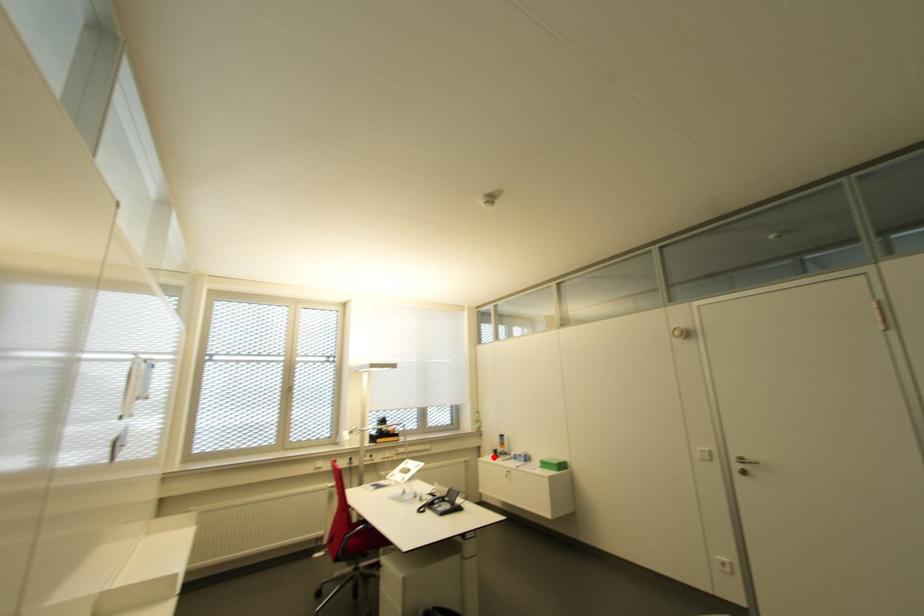
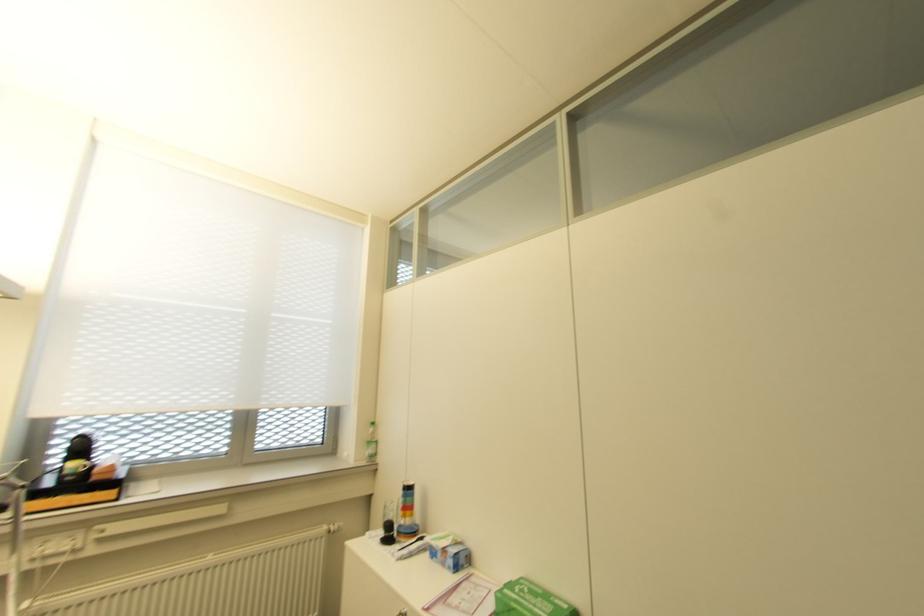
Locate, in the second image, the point that corresponds to the highlighted location in the first image.

(385, 540)